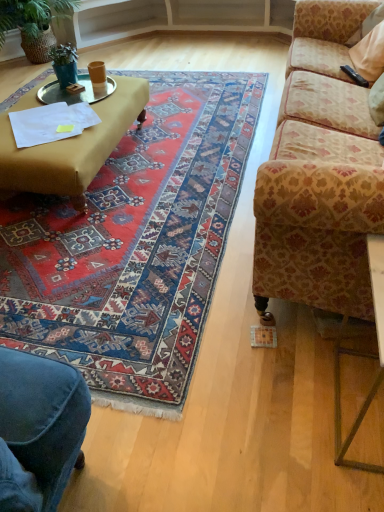
Question: Is green matte plant at upper left, positioned as the 1th houseplant in front-to-back order, spatially inside carpet with intricate patterns at center, or outside of it?

Choices:
 (A) inside
 (B) outside

Answer: (B)

Question: From their relative heights in the image, would you say green matte plant at upper left, which ranks as the second houseplant in left-to-right order, is taller or shorter than carpet with intricate patterns at center?

Choices:
 (A) tall
 (B) short

Answer: (A)

Question: Which of these objects is positioned closest to the black plastic remote control at upper right?

Choices:
 (A) metallic gold table at lower right
 (B) patterned fabric couch at right
 (C) metallic silver tray at upper left
 (D) green woven basket at upper left, which is the 2th houseplant from front to back
 (E) carpet with intricate patterns at center

Answer: (B)

Question: Estimate the real-world distances between objects in this image. Which object is farther from the metallic gold table at lower right?

Choices:
 (A) metallic silver tray at upper left
 (B) carpet with intricate patterns at center
 (C) black plastic remote control at upper right
 (D) patterned fabric couch at right
 (E) green woven basket at upper left, acting as the 2th houseplant starting from the right

Answer: (E)